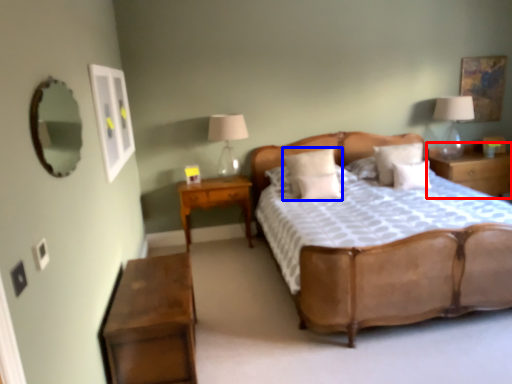
Question: Which point is further to the camera, nightstand (highlighted by a red box) or pillow (highlighted by a blue box)?

Choices:
 (A) nightstand
 (B) pillow

Answer: (A)